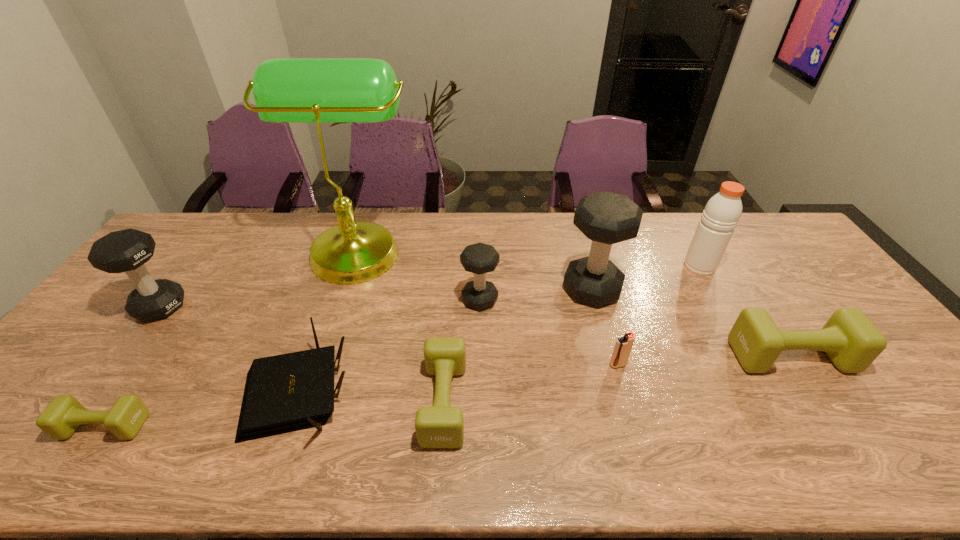
Where is `object present at the near left corner`? The image size is (960, 540). object present at the near left corner is located at coordinates (61, 418).

This screenshot has height=540, width=960. Identify the location of free space at the far edge of the desktop. (362, 212).

In the image, there is a desktop. Identify the location of vacant space at the left edge. (154, 268).

This screenshot has width=960, height=540. In order to click on free point at the right edge in this screenshot , I will do `click(878, 387)`.

In the image, there is a desktop. Where is `vacant area at the far left corner`? vacant area at the far left corner is located at coordinates (202, 213).

The height and width of the screenshot is (540, 960). Find the location of `free spot between the orange shaker and the biggest gray dumbbell`. free spot between the orange shaker and the biggest gray dumbbell is located at coordinates (646, 278).

Locate an element on the screen. The image size is (960, 540). free space between the fourth tallest object and the igniter is located at coordinates (389, 336).

Where is `empty location between the third tallest dumbbell and the biggest gray dumbbell`? Image resolution: width=960 pixels, height=540 pixels. empty location between the third tallest dumbbell and the biggest gray dumbbell is located at coordinates (536, 294).

Find the location of a particular element. The width and height of the screenshot is (960, 540). unoccupied area between the black router and the rightmost olive dumbbell is located at coordinates (544, 374).

Locate an element on the screen. free point between the biggest gray dumbbell and the second smallest olive dumbbell is located at coordinates (518, 346).